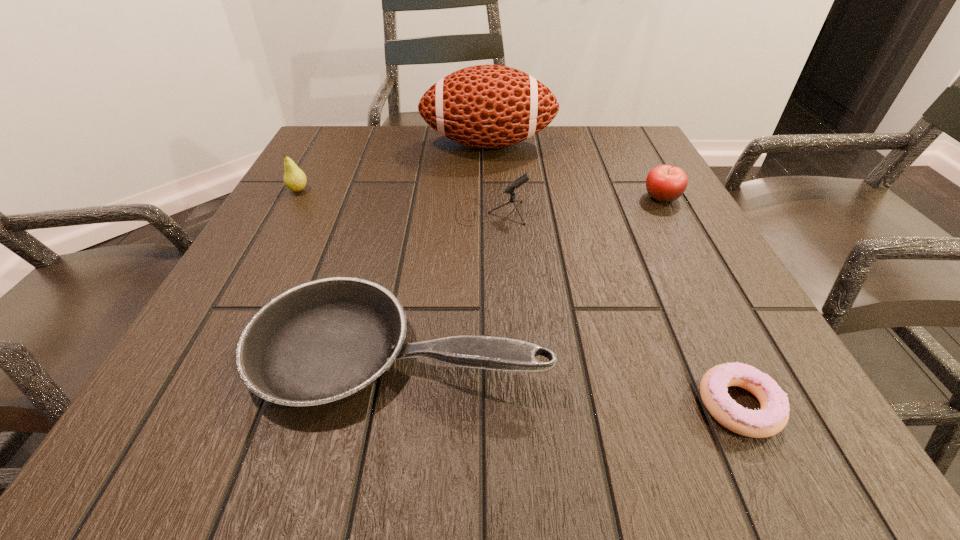
Locate an element on the screen. The image size is (960, 540). free space between the apple and the microphone is located at coordinates (577, 205).

Where is `vacant area between the leftmost object and the apple`? vacant area between the leftmost object and the apple is located at coordinates (480, 194).

Identify the location of blank region between the apple and the tallest object. This screenshot has width=960, height=540. (575, 171).

Locate an element on the screen. Image resolution: width=960 pixels, height=540 pixels. vacant region between the leftmost object and the frying pan is located at coordinates point(348,270).

Find the location of `vacant space that is in between the football and the microphone`. vacant space that is in between the football and the microphone is located at coordinates (490, 178).

Locate an element on the screen. The height and width of the screenshot is (540, 960). free area in between the apple and the leftmost object is located at coordinates (480, 194).

The width and height of the screenshot is (960, 540). In order to click on empty location between the pear and the doughnut in this screenshot , I will do `click(518, 298)`.

I want to click on free spot between the shortest object and the apple, so click(x=700, y=301).

Where is `vacant point located between the apple and the microphone`? This screenshot has width=960, height=540. vacant point located between the apple and the microphone is located at coordinates (577, 205).

Where is `vacant region between the microphone and the leftmost object`? Image resolution: width=960 pixels, height=540 pixels. vacant region between the microphone and the leftmost object is located at coordinates (396, 201).